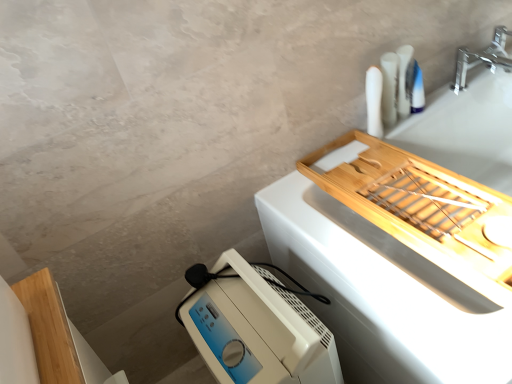
Question: Is silver metallic faucet at upper right turned away from natural wood tray at upper right?

Choices:
 (A) no
 (B) yes

Answer: (A)

Question: Is silver metallic faucet at upper right further to camera compared to natural wood tray at upper right?

Choices:
 (A) no
 (B) yes

Answer: (B)

Question: Is silver metallic faucet at upper right at the left side of natural wood tray at upper right?

Choices:
 (A) yes
 (B) no

Answer: (B)

Question: Does silver metallic faucet at upper right have a lesser width compared to natural wood tray at upper right?

Choices:
 (A) yes
 (B) no

Answer: (A)

Question: From a real-world perspective, is silver metallic faucet at upper right over natural wood tray at upper right?

Choices:
 (A) no
 (B) yes

Answer: (B)

Question: From the image's perspective, is natural wood tray at upper right located above or below white matte toothpaste tubes at upper right, the second toiletry in the right-to-left sequence?

Choices:
 (A) above
 (B) below

Answer: (B)

Question: In the image, is natural wood tray at upper right positioned in front of or behind white matte toothpaste tubes at upper right, which is counted as the 2th toiletry, starting from the left?

Choices:
 (A) front
 (B) behind

Answer: (A)

Question: From a real-world perspective, is natural wood tray at upper right above or below white matte toothpaste tubes at upper right, the second toiletry in the right-to-left sequence?

Choices:
 (A) below
 (B) above

Answer: (A)

Question: Considering the positions of natural wood tray at upper right and white matte toothpaste tubes at upper right, the second toiletry in the right-to-left sequence, in the image, is natural wood tray at upper right taller or shorter than white matte toothpaste tubes at upper right, the second toiletry in the right-to-left sequence,?

Choices:
 (A) short
 (B) tall

Answer: (B)

Question: From a real-world perspective, is silver metallic faucet at upper right physically located above or below white plastic humidifier at lower left?

Choices:
 (A) below
 (B) above

Answer: (B)

Question: In terms of size, does silver metallic faucet at upper right appear bigger or smaller than white plastic humidifier at lower left?

Choices:
 (A) small
 (B) big

Answer: (A)

Question: Based on their positions, is silver metallic faucet at upper right located to the left or right of white plastic humidifier at lower left?

Choices:
 (A) right
 (B) left

Answer: (A)

Question: Relative to white plastic humidifier at lower left, is silver metallic faucet at upper right in front or behind?

Choices:
 (A) front
 (B) behind

Answer: (B)

Question: In the image, is white plastic toothbrush at upper right, acting as the first toiletry starting from the left, on the left side or the right side of white matte toothpaste tubes at upper right, the second toiletry in the right-to-left sequence?

Choices:
 (A) left
 (B) right

Answer: (A)

Question: Is white plastic toothbrush at upper right, acting as the first toiletry starting from the left, taller or shorter than white matte toothpaste tubes at upper right, which is counted as the 2th toiletry, starting from the left?

Choices:
 (A) short
 (B) tall

Answer: (B)